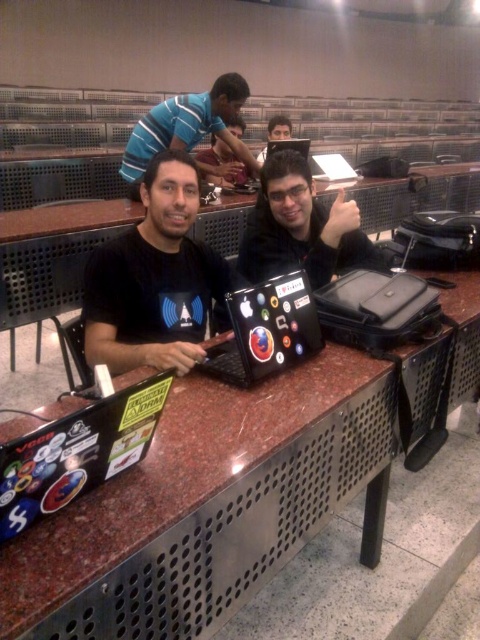
You are organizing a small event in the lecture hall and need to place two name tags on the table for the speakers. The name tags must be placed exactly 1.5 meters apart. Given the current setup, can you position the name tags between the black matte shirt at center and the blue striped shirt at upper center?

The black matte shirt at center and blue striped shirt at upper center are 1.51 meters apart from each other. Since the required distance is 1.5 meters, the name tags can be placed at this location as the distance is sufficient.